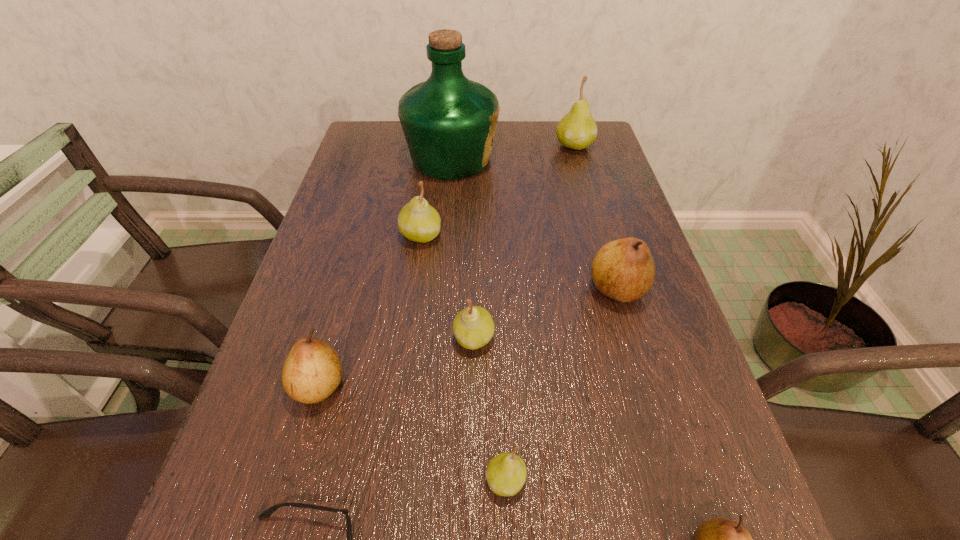
This screenshot has height=540, width=960. Identify the location of vacant area that lies between the tallest object and the farthest brown pear. (534, 224).

The width and height of the screenshot is (960, 540). In order to click on vacant region between the tallest pear and the leftmost brown pear in this screenshot , I will do `click(446, 266)`.

Where is `free space between the seventh nearest object and the green liquor`? Image resolution: width=960 pixels, height=540 pixels. free space between the seventh nearest object and the green liquor is located at coordinates pyautogui.click(x=436, y=197).

Find the location of a particular element. The image size is (960, 540). vacant space in between the tallest pear and the green liquor is located at coordinates (513, 152).

Locate which object ranks fifth in proximity to the biggest brown pear. Please provide its 2D coordinates. Your answer should be formatted as a tuple, i.e. [(x, y)], where the tuple contains the x and y coordinates of a point satisfying the conditions above.

[(719, 539)]

Where is `the fourth closest object to the fifth farthest object`? This screenshot has height=540, width=960. the fourth closest object to the fifth farthest object is located at coordinates (418, 221).

You are a GUI agent. You are given a task and a screenshot of the screen. Output one action in this format:
    pyautogui.click(x=<x>, y=<y>)
    Task: Click on the pear that is the sixth closest one to the spectacles
    The width and height of the screenshot is (960, 540).
    Given the screenshot: What is the action you would take?
    pyautogui.click(x=418, y=221)

I want to click on pear that is the second closest to the leftmost brown pear, so click(x=506, y=473).

Identify the location of green pear identified as the fourth closest to the spectacles. This screenshot has width=960, height=540. (577, 130).

Identify which green pear is the fourth closest to the fourth farthest object. Please provide its 2D coordinates. Your answer should be formatted as a tuple, i.e. [(x, y)], where the tuple contains the x and y coordinates of a point satisfying the conditions above.

[(577, 130)]